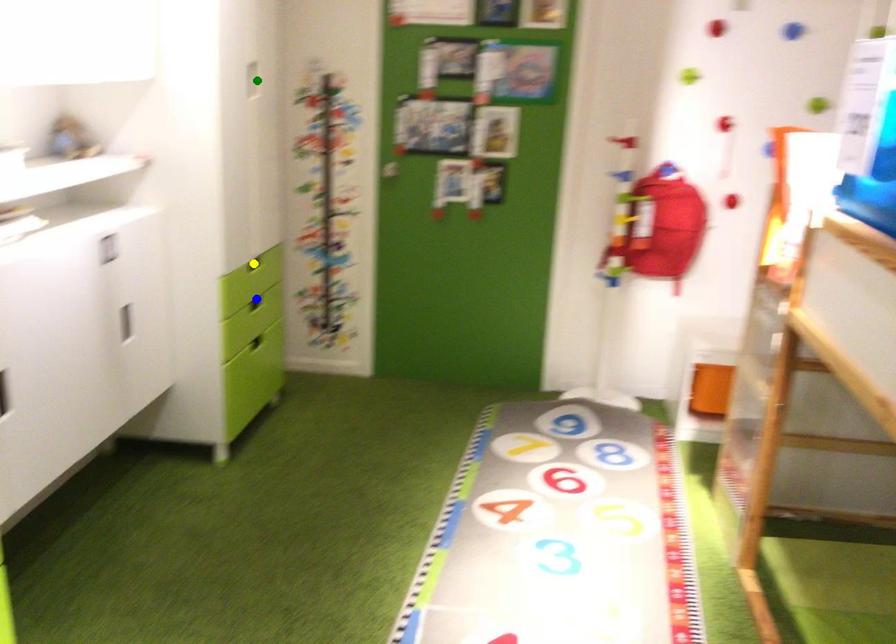
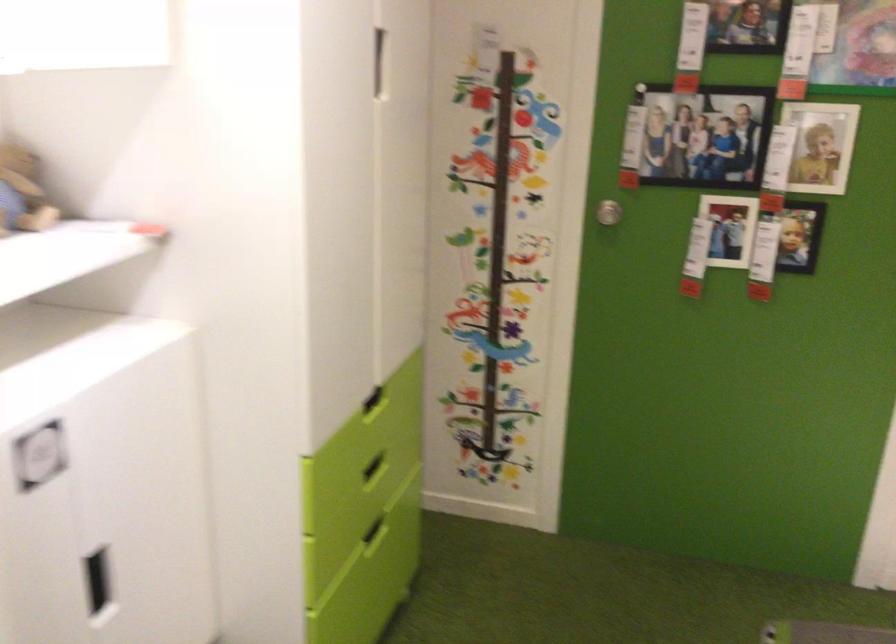
I am providing you with two images of the same scene from different viewpoints. Three points are marked in image1. Which point corresponds to a part or object that is occluded in image2?In image1, three points are marked. Which of them correspond to a part or object that is occluded in image2?Among the three points shown in image1, which one corresponds to a part or object that is no longer visible due to occlusion in image2?

yellow point